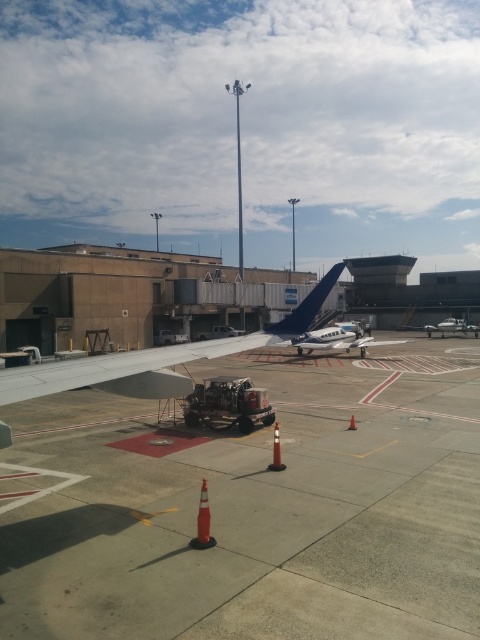
Can you confirm if metallic silver airplane at center is positioned below orange matte cone at center?

Actually, metallic silver airplane at center is above orange matte cone at center.

Who is more distant from viewer, (457, 321) or (355, 428)?

Positioned behind is point (457, 321).

The width and height of the screenshot is (480, 640). What are the coordinates of `metallic silver airplane at center` in the screenshot? It's located at (446, 326).

Based on the photo, between blue matte airplane tail at center and orange rubber cone at center, which one appears on the left side from the viewer's perspective?

Positioned to the left is orange rubber cone at center.

Is blue matte airplane tail at center to the right of orange rubber cone at center from the viewer's perspective?

Yes, blue matte airplane tail at center is to the right of orange rubber cone at center.

Find the location of a particular element. blue matte airplane tail at center is located at coordinates (308, 305).

Which is more to the right, concrete tarmac at lower left or metallic blue airplane at center?

metallic blue airplane at center is more to the right.

Consider the image. Is concrete tarmac at lower left shorter than metallic blue airplane at center?

Indeed, concrete tarmac at lower left has a lesser height compared to metallic blue airplane at center.

Which is in front, point (279, 348) or point (335, 339)?

Point (335, 339) is more forward.

Locate an element on the screen. concrete tarmac at lower left is located at coordinates (252, 508).